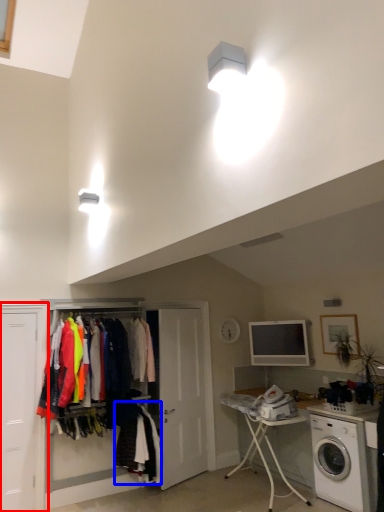
Question: Which object is closer to the camera taking this photo, door (highlighted by a red box) or clothing (highlighted by a blue box)?

Choices:
 (A) door
 (B) clothing

Answer: (A)